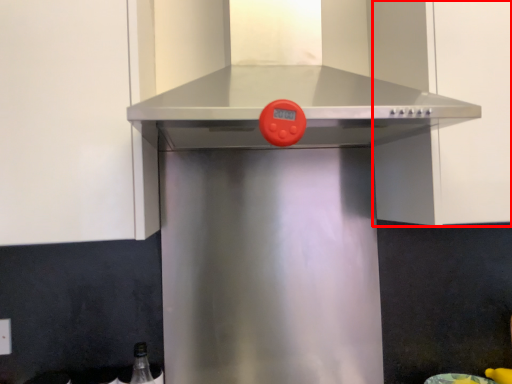
Question: From the image's perspective, what is the correct spatial positioning of cabinetry (annotated by the red box) in reference to vent?

Choices:
 (A) below
 (B) above

Answer: (A)